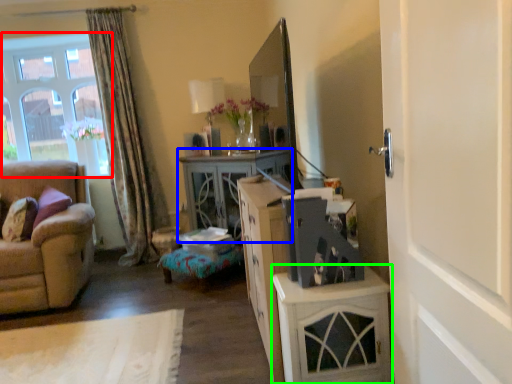
Question: Which object is positioned closest to window (highlighted by a red box)? Select from desk (highlighted by a blue box) and cabinetry (highlighted by a green box).

Choices:
 (A) desk
 (B) cabinetry

Answer: (A)